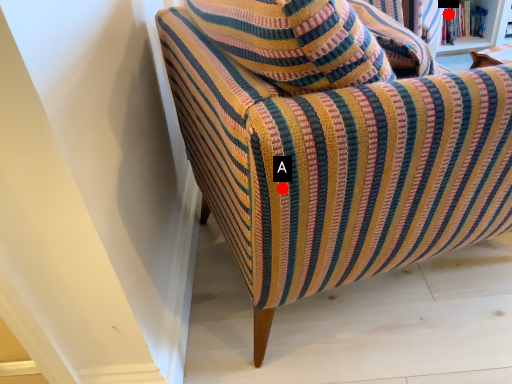
Question: Two points are circled on the image, labeled by A and B beside each circle. Which point is farther to the camera?

Choices:
 (A) A is further
 (B) B is further

Answer: (B)